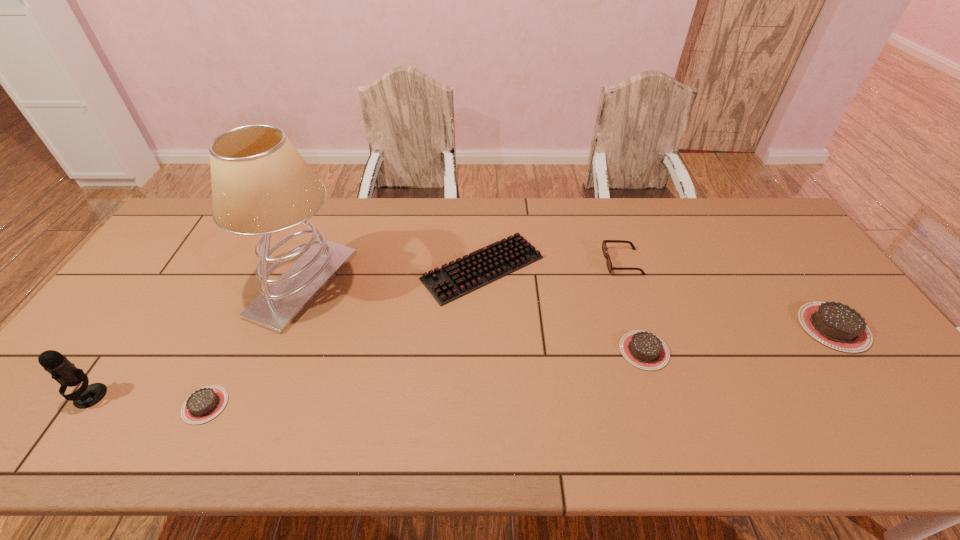
Where is `object present at the far edge`? object present at the far edge is located at coordinates (485, 265).

Where is `chocolate cake that is at the near edge`? The image size is (960, 540). chocolate cake that is at the near edge is located at coordinates (204, 404).

I want to click on microphone that is at the near edge, so click(x=62, y=370).

Find the location of a particular element. The height and width of the screenshot is (540, 960). object at the left edge is located at coordinates tap(62, 370).

This screenshot has width=960, height=540. What are the coordinates of `object situated at the right edge` in the screenshot? It's located at (835, 325).

Find the location of a particular element. The height and width of the screenshot is (540, 960). object that is at the near left corner is located at coordinates (62, 370).

This screenshot has width=960, height=540. In the image, there is a desktop. Identify the location of vacant space at the far edge. point(531,211).

Where is `vacant space at the left edge of the desktop`? Image resolution: width=960 pixels, height=540 pixels. vacant space at the left edge of the desktop is located at coordinates (129, 368).

You are a GUI agent. You are given a task and a screenshot of the screen. Output one action in this format:
    pyautogui.click(x=<x>, y=<y>)
    Task: Click on the vacant space at the right edge of the desktop
    
    Given the screenshot: What is the action you would take?
    coord(814,298)

Where is `vacant point located between the table lamp and the fourth object from right to left`? The image size is (960, 540). vacant point located between the table lamp and the fourth object from right to left is located at coordinates (393, 276).